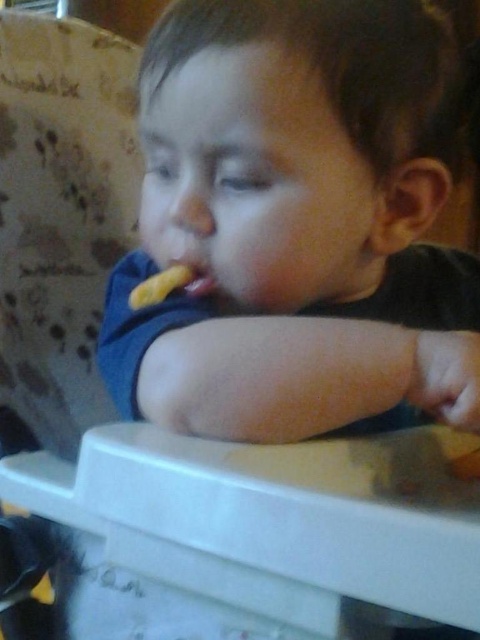
You are a photographer trying to capture the child in the high chair. You notice a point at coordinates (298,224) in the image. What is the texture of the material at that point?

The point at coordinates (298,224) corresponds to the smooth blue shirt at center.

You are a photographer trying to capture a closeup of the yellow matte food at mouth. The camera lens is 16.18 inches away from the food. Is this distance within the minimum focusing distance of most standard cameras, which is typically around 8 inches?

The yellow matte food at mouth and camera are 16.18 inches apart. Since the minimum focusing distance for most standard cameras is around 8 inches, the distance of 16.18 inches is beyond the minimum requirement, so the camera should be able to focus properly on the yellow matte food at mouth.

You are a photographer taking a picture of the child in the high chair. You need to ensure that the smooth blue shirt at center and the yellow matte food at mouth are both visible in the frame. Based on their positions, which object should be placed higher in the photo to include both?

The smooth blue shirt at center is taller than the yellow matte food at mouth, so to include both in the frame, the photographer should position the camera so the smooth blue shirt at center is higher in the photo.